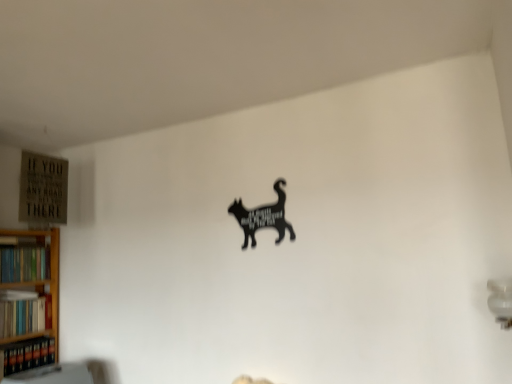
Question: Do you think hardcover books at lower left, the 1th book in the bottom-to-top sequence, is within black matte cat at center, or outside of it?

Choices:
 (A) inside
 (B) outside

Answer: (B)

Question: Looking at their shapes, would you say hardcover books at lower left, which is the third book in top-to-bottom order, is wider or thinner than black matte cat at center?

Choices:
 (A) thin
 (B) wide

Answer: (B)

Question: Considering the real-world distances, which object is closest to the hardcover books at lower left, the 1th book in the bottom-to-top sequence?

Choices:
 (A) hardcover books at left, the second book in the top-to-bottom sequence
 (B) hardcover books at left, the 1th book positioned from the top
 (C) black matte cat at center

Answer: (A)

Question: Estimate the real-world distances between objects in this image. Which object is closer to the hardcover books at left, the 2th book when ordered from bottom to top?

Choices:
 (A) hardcover books at left, the 1th book positioned from the top
 (B) hardcover books at lower left, which is the third book in top-to-bottom order
 (C) black matte cat at center

Answer: (B)